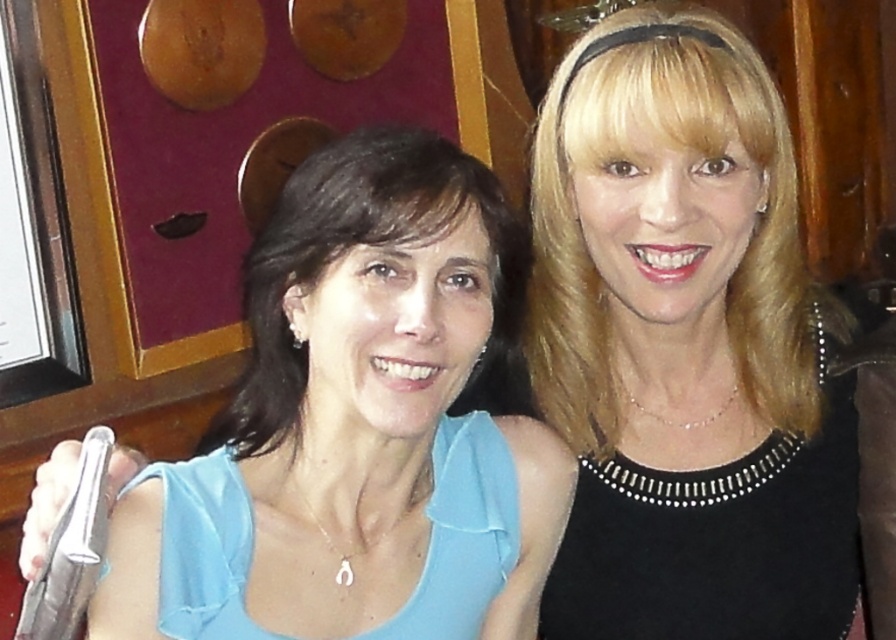
From the picture: You are a photographer setting up for a photoshoot in the described scene. You need to place a spotlight on the right side of the matte blue blouse at center to highlight it. Will the spotlight interfere with the black satin dress at upper right?

The black satin dress at upper right is positioned on the right side of the matte blue blouse at center, so placing the spotlight on the right side of the matte blue blouse at center would directly shine towards the black satin dress at upper right. This might cause unwanted glare or reflection on the dress, so it could interfere.

You are a photographer setting up a shoot in this room. You need to place a small prop between the black satin dress at upper right and the matte blue blouse at center. Can you fit it there?

The black satin dress at upper right is positioned over the matte blue blouse at center, so there is no space between them to place the prop.

In the scene shown: You are a photographer setting up a shoot in this scene. You need to ensure that the black satin dress at upper right and the matte blue blouse at center are both visible in the frame. Given their height difference, which one might require adjusting the camera angle to be fully captured?

The black satin dress at upper right is taller than the matte blue blouse at center, so you may need to adjust the camera angle to ensure the taller black satin dress at upper right is fully visible in the frame.